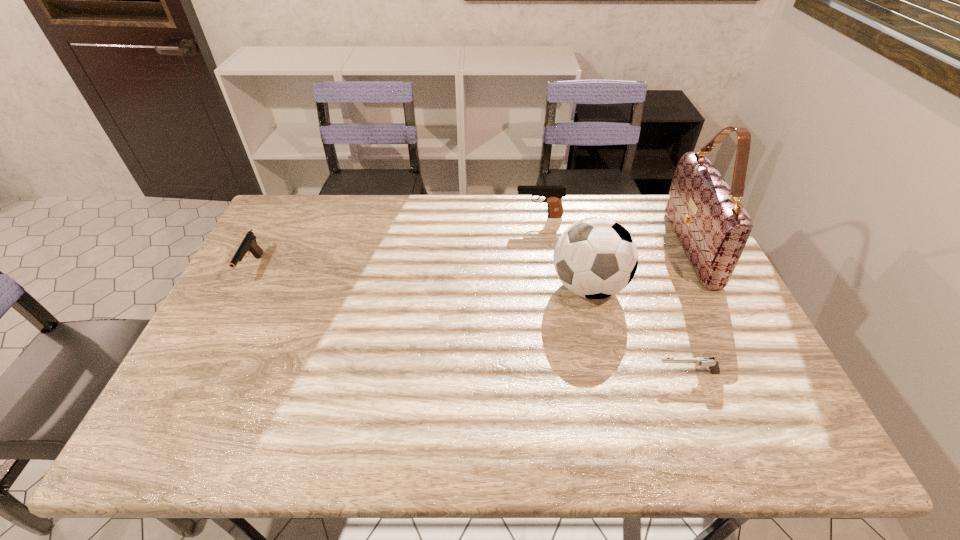
This screenshot has height=540, width=960. Find the location of `the rightmost object`. the rightmost object is located at coordinates (713, 227).

Locate an element on the screen. the tallest object is located at coordinates (713, 227).

Identify the location of soccer ball. (595, 258).

This screenshot has height=540, width=960. Identify the location of the farthest pistol. (553, 194).

You are a GUI agent. You are given a task and a screenshot of the screen. Output one action in this format:
    pyautogui.click(x=<x>, y=<y>)
    Task: Click on the third tallest object
    The height and width of the screenshot is (540, 960).
    Given the screenshot: What is the action you would take?
    pyautogui.click(x=553, y=194)

You are a GUI agent. You are given a task and a screenshot of the screen. Output one action in this format:
    pyautogui.click(x=<x>, y=<y>)
    Task: Click on the second nearest pistol
    Image resolution: width=960 pixels, height=540 pixels.
    Given the screenshot: What is the action you would take?
    pyautogui.click(x=249, y=244)

Where is `the fourth tallest object`? the fourth tallest object is located at coordinates (249, 244).

Where is `the nearest pistol`? The image size is (960, 540). the nearest pistol is located at coordinates (713, 365).

Find the location of a particular element. The height and width of the screenshot is (540, 960). the second object from right to left is located at coordinates (713, 365).

Where is `free space located 0.220m on the front of the handbag with the clasp`? This screenshot has height=540, width=960. free space located 0.220m on the front of the handbag with the clasp is located at coordinates (607, 247).